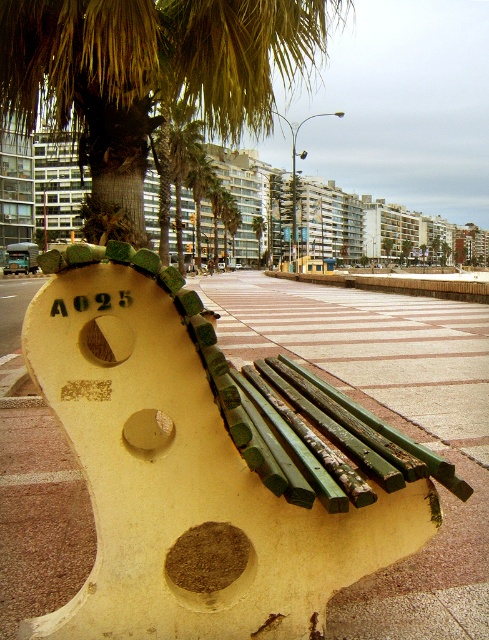
You are standing at the point labeled A025 on the violin bench. You want to walk to the palm tree located at point (195, 125). However, there is an obstacle at point (30, 131). Which direction should you move first to avoid the obstacle and reach your destination?

You should move away from the obstacle at point (30, 131) first, since it is in front of point (195, 125). Once you go around it, you can proceed towards the palm tree at point (195, 125).

Based on the photo, you are standing at the camera position and want to take a photo of the green leafy palm tree at upper center. The camera has a maximum focus range of 3.5 meters. Will the palm tree be in focus?

The green leafy palm tree at upper center is 3.92 meters away from camera, which exceeds the camera maximum focus range of 3.5 meters. So the palm tree will not be in focus.

You are a city planner assessing the space between the smooth concrete bench at center and the green leafy palm tree at upper center. Which object takes up more area in the image?

The green leafy palm tree at upper center occupies more space than the smooth concrete bench at center.